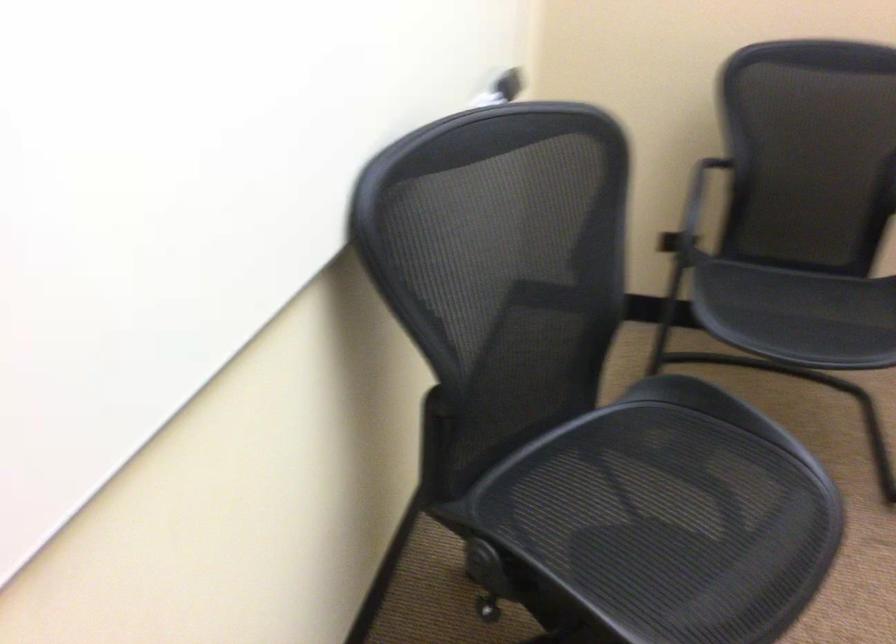
This screenshot has height=644, width=896. What do you see at coordinates (692, 212) in the screenshot?
I see `the chair armrest` at bounding box center [692, 212].